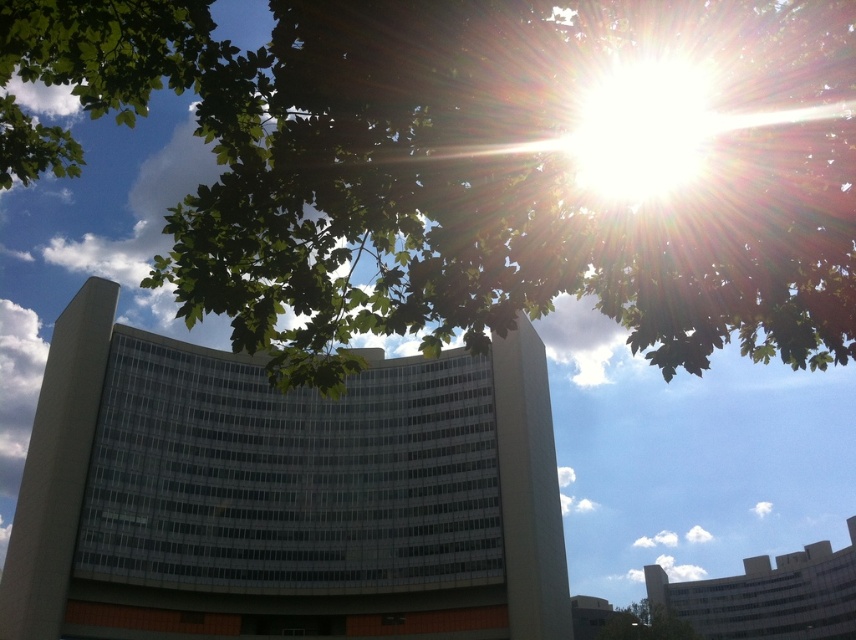
Question: Which point is closer to the camera?

Choices:
 (A) (666, 627)
 (B) (595, 1)

Answer: (B)

Question: Does green leafy tree at upper center lie behind green leafy tree at lower right?

Choices:
 (A) no
 (B) yes

Answer: (A)

Question: Can you confirm if green leafy tree at upper center is positioned above green leafy tree at lower right?

Choices:
 (A) yes
 (B) no

Answer: (A)

Question: Can you confirm if green leafy tree at upper center is positioned to the left of green leafy tree at lower right?

Choices:
 (A) yes
 (B) no

Answer: (A)

Question: Among these points, which one is nearest to the camera?

Choices:
 (A) tap(682, 636)
 (B) tap(545, 128)

Answer: (B)

Question: Among these points, which one is nearest to the camera?

Choices:
 (A) (626, 605)
 (B) (611, 269)

Answer: (B)